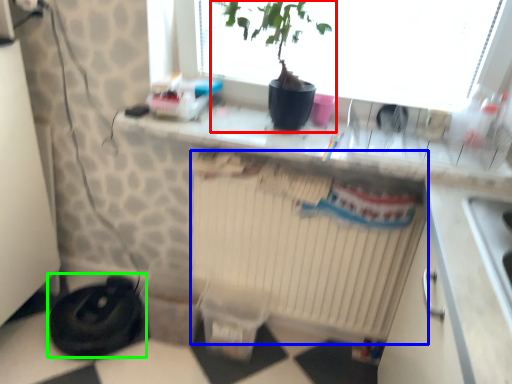
Question: Which object is positioned closest to houseplant (highlighted by a red box)? Select from radiator (highlighted by a blue box) and appliance (highlighted by a green box).

Choices:
 (A) radiator
 (B) appliance

Answer: (A)